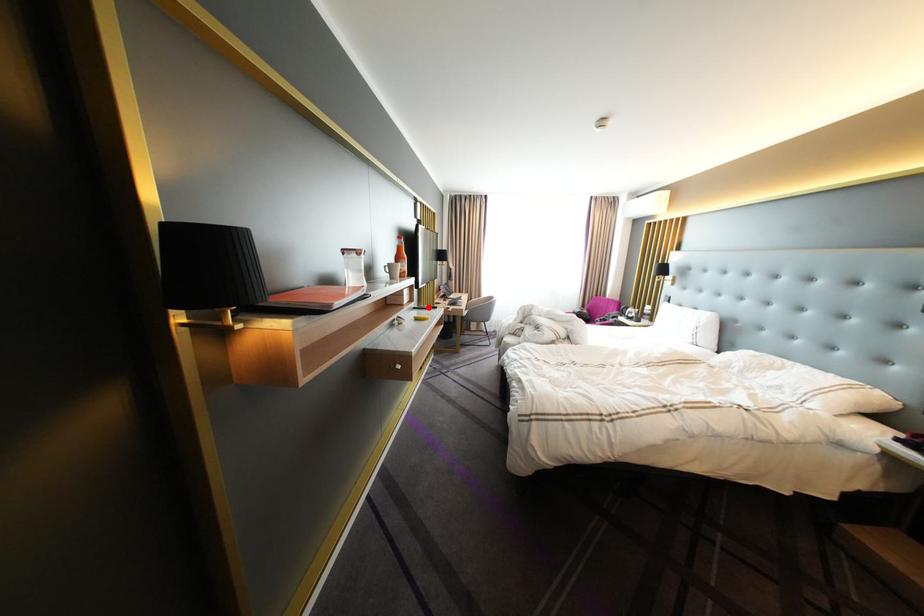
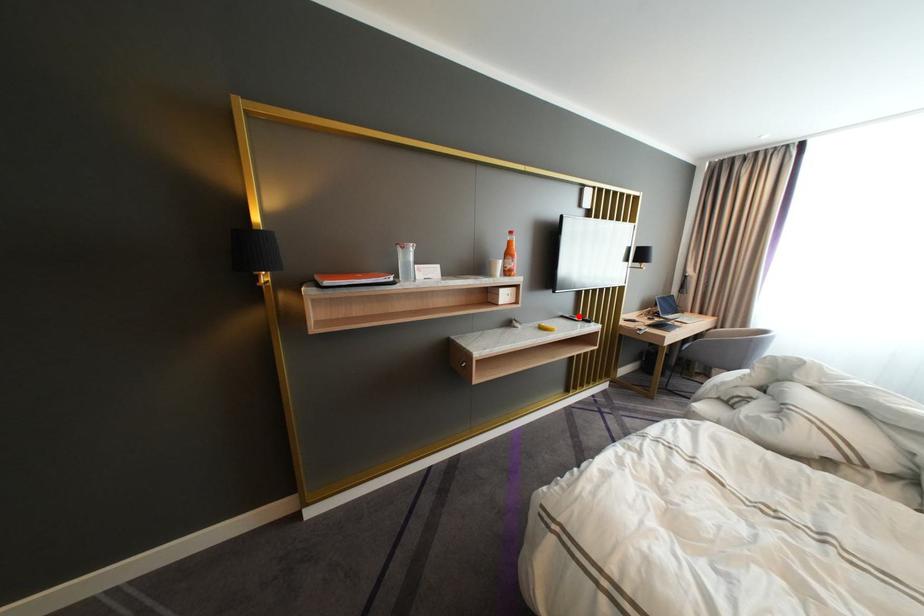
I am providing you with two images of the same scene from different viewpoints. A red point is marked on the first image and another point is marked on the second image. Do the highlighted points in image1 and image2 indicate the same real-world spot?

Yes